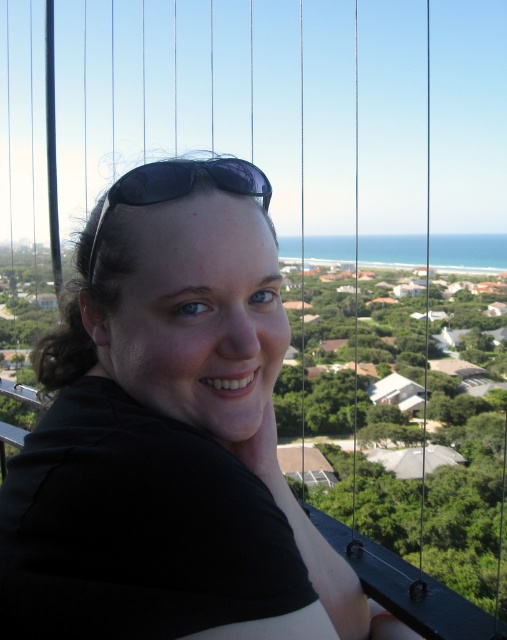
Question: Among these points, which one is farthest from the camera?

Choices:
 (A) (227, 550)
 (B) (95, 236)

Answer: (B)

Question: Is black matte shirt at center above black matte sunglasses at center?

Choices:
 (A) yes
 (B) no

Answer: (B)

Question: Does black matte shirt at center appear on the left side of black matte sunglasses at center?

Choices:
 (A) yes
 (B) no

Answer: (B)

Question: Which object appears closest to the camera in this image?

Choices:
 (A) black matte shirt at center
 (B) black matte sunglasses at center

Answer: (A)

Question: Can you confirm if black matte shirt at center is bigger than black matte sunglasses at center?

Choices:
 (A) no
 (B) yes

Answer: (B)